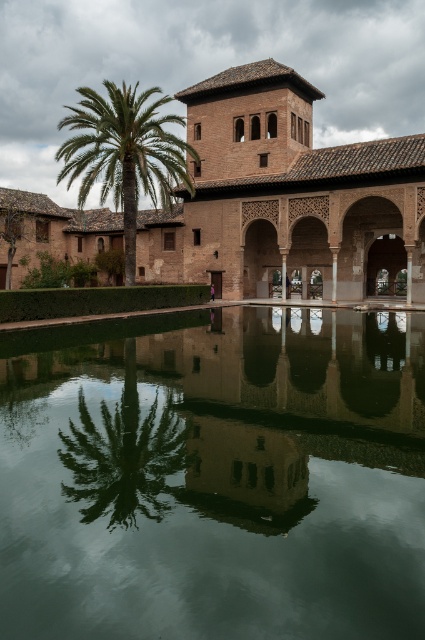
The width and height of the screenshot is (425, 640). In order to click on brown clay palace at center in this screenshot , I will do (x=286, y=198).

Consider the image. Who is positioned more to the right, brown clay palace at center or green leafy palm at center?

brown clay palace at center

Who is more distant from viewer, (252, 224) or (113, 179)?

The point (252, 224) is behind.

Where is `brown clay palace at center`? The height and width of the screenshot is (640, 425). brown clay palace at center is located at coordinates (286, 198).

Measure the distance between green reflective water at center and green leafy palm at center.

green reflective water at center and green leafy palm at center are 25.78 meters apart.

Is green reflective water at center to the left of green leafy palm at center from the viewer's perspective?

In fact, green reflective water at center is to the right of green leafy palm at center.

Which is in front, point (68, 396) or point (119, 172)?

Point (68, 396) is more forward.

Locate an element on the screen. This screenshot has height=640, width=425. green reflective water at center is located at coordinates (218, 481).

Looking at this image, can you confirm if green reflective water at center is shorter than brown clay palace at center?

Yes, green reflective water at center is shorter than brown clay palace at center.

Can you confirm if green reflective water at center is positioned to the left of brown clay palace at center?

Yes, green reflective water at center is to the left of brown clay palace at center.

At what (x,y) coordinates should I click in order to perform the action: click on green reflective water at center. Please return your answer as a coordinate pair (x, y). The image size is (425, 640). Looking at the image, I should click on (218, 481).